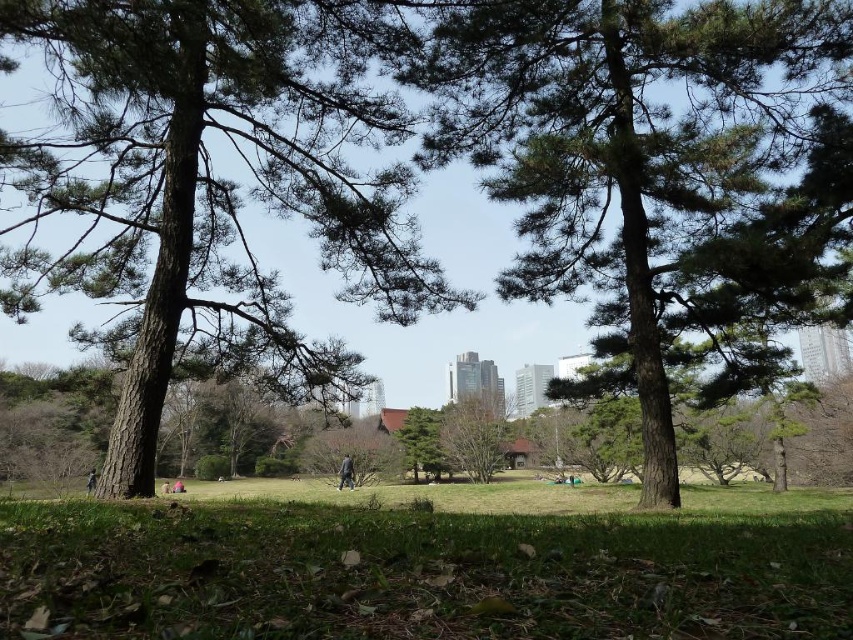
Question: Which point is closer to the camera taking this photo?

Choices:
 (A) (167, 480)
 (B) (91, 468)

Answer: (B)

Question: Can you confirm if green leafy tree at center is positioned above dark gray fabric person at lower left?

Choices:
 (A) yes
 (B) no

Answer: (A)

Question: Among these objects, which one is nearest to the camera?

Choices:
 (A) green rough bark tree at center
 (B) brown fabric person at lower center
 (C) smooth brown tree trunk at center
 (D) green grass at center

Answer: (D)

Question: Estimate the real-world distances between objects in this image. Which object is farther from the green leafy tree at center?

Choices:
 (A) green textured tree at center
 (B) green rough bark tree at center
 (C) green grass at center
 (D) dark gray fabric jacket at center

Answer: (B)

Question: Where is smooth brown tree trunk at center located in relation to dark gray fabric person at lower left in the image?

Choices:
 (A) left
 (B) right

Answer: (B)

Question: Is green rough bark tree at center behind brown fabric person at lower center?

Choices:
 (A) yes
 (B) no

Answer: (B)